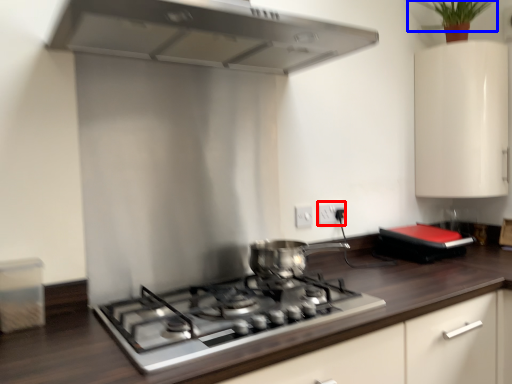
Question: Which point is further to the camera, electric outlet (highlighted by a red box) or plant (highlighted by a blue box)?

Choices:
 (A) electric outlet
 (B) plant

Answer: (A)